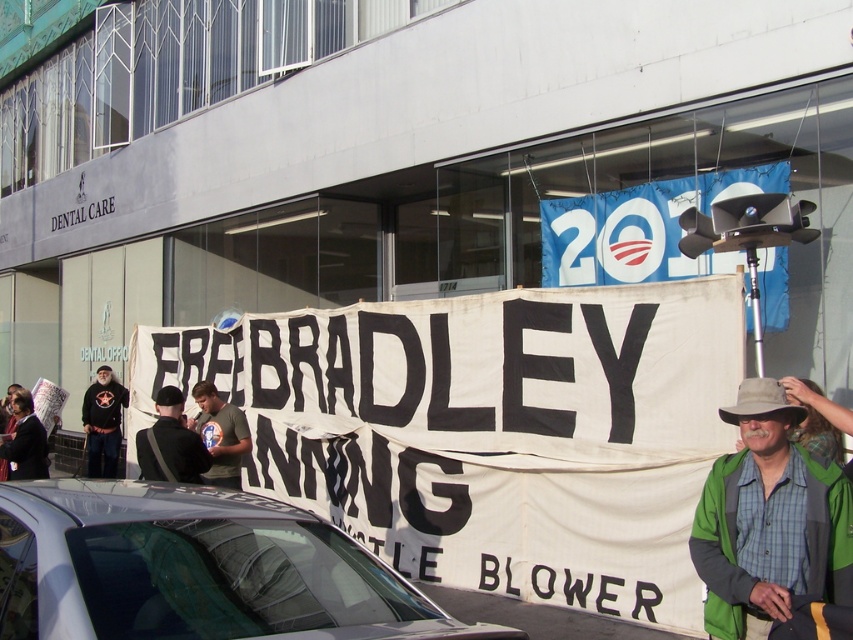
You are a photographer trying to capture a clear shot of the banner and the protesters. You notice the dark gray fabric jacket at center and the tan fabric cowboy hat at lower right. Which object is positioned higher in the frame?

The dark gray fabric jacket at center is taller than the tan fabric cowboy hat at lower right, so the dark gray fabric jacket at center is positioned higher in the frame.

You are a photographer standing at the edge of the protest scene outside the dental care clinic. You want to capture a photo of the silver metallic car at lower center without any obstructions. Based on its 2D coordinates, what is the best direction to move to ensure the car is centered in your frame?

The silver metallic car at lower center is located at coordinates 0.891 on the x axis and 0.231 on the y axis. To center it in the frame, move towards the lower right direction to adjust the camera angle so the car is positioned centrally.